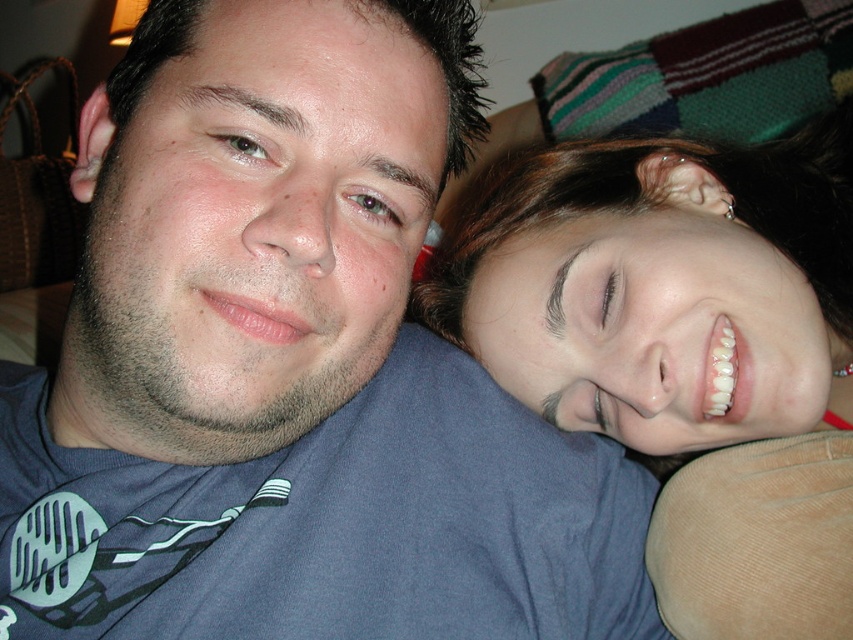
Question: Which object is the farthest from the brown matte eye at center?

Choices:
 (A) brown matte eye at upper left
 (B) smooth skin face at upper right

Answer: (B)

Question: Does smooth skin face at upper right come behind brown matte eye at center?

Choices:
 (A) no
 (B) yes

Answer: (B)

Question: Which object is positioned farthest from the brown matte eye at center?

Choices:
 (A) brown matte eye at upper left
 (B) smooth skin face at upper right

Answer: (B)

Question: Which of the following is the closest to the observer?

Choices:
 (A) brown matte eye at upper left
 (B) brown matte eye at center

Answer: (A)

Question: Is smooth skin face at upper right closer to camera compared to brown matte eye at center?

Choices:
 (A) yes
 (B) no

Answer: (B)

Question: Is smooth skin face at upper right in front of brown matte eye at upper left?

Choices:
 (A) yes
 (B) no

Answer: (B)